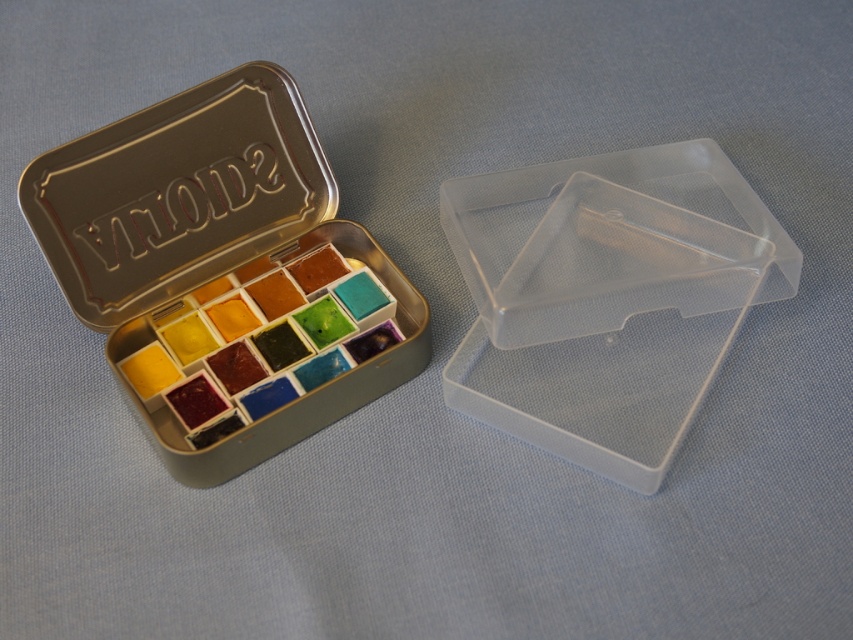
Between point (123, 337) and point (705, 349), which one is positioned in front?

Point (123, 337)

Which of these two, metallic tin at upper left or transparent plastic box at center, stands taller?

With more height is metallic tin at upper left.

Is point (193, 300) farther from viewer compared to point (705, 387)?

Yes, it is.

You are a GUI agent. You are given a task and a screenshot of the screen. Output one action in this format:
    pyautogui.click(x=<x>, y=<y>)
    Task: Click on the metallic tin at upper left
    
    Given the screenshot: What is the action you would take?
    pyautogui.click(x=219, y=268)